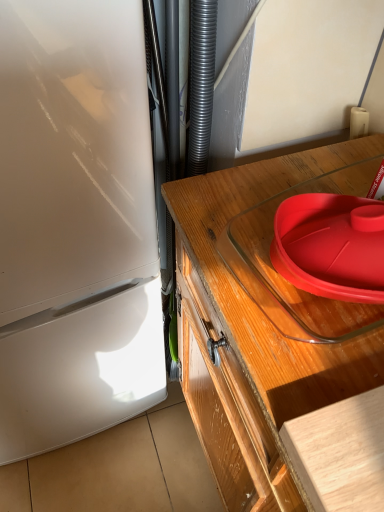
Find the location of `vacant point above transparent glass tray at upper right (from a real-world perspective)`. vacant point above transparent glass tray at upper right (from a real-world perspective) is located at coordinates (279, 268).